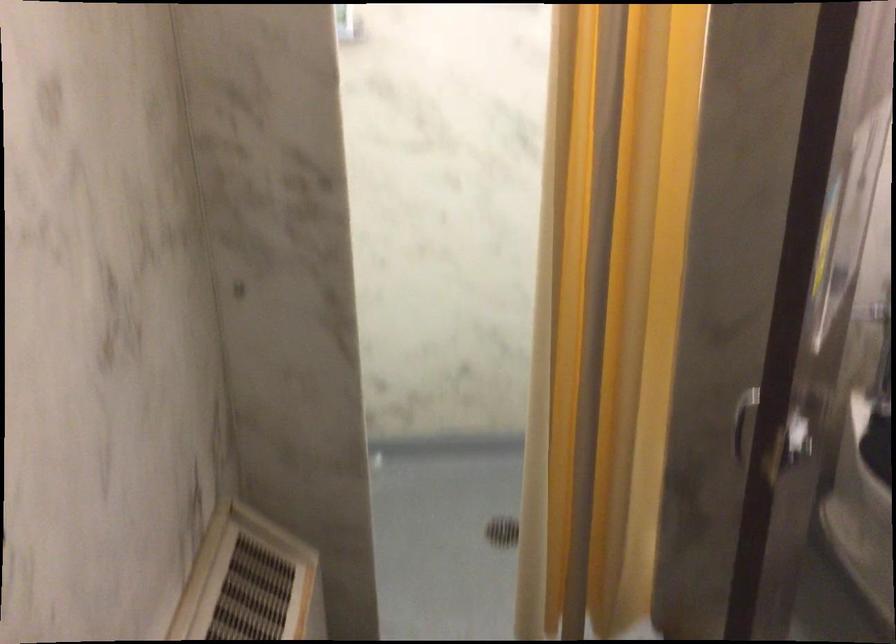
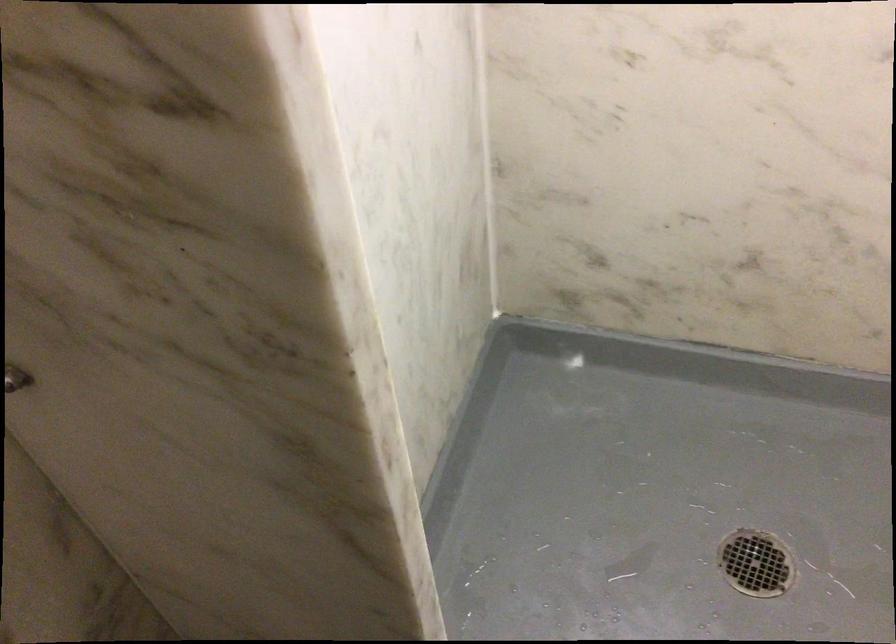
Question: In a continuous first-person perspective shot, in which direction is the camera moving?

Choices:
 (A) Left
 (B) Right
 (C) Forward
 (D) Backward

Answer: (C)